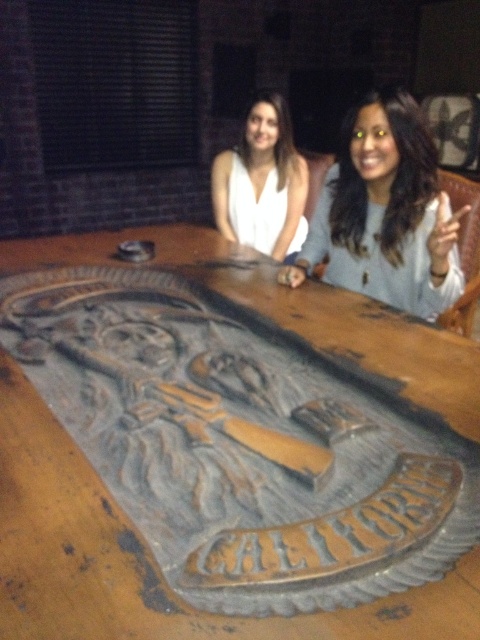
Question: Does rustic wood table at center appear on the right side of white matte shirt at center?

Choices:
 (A) yes
 (B) no

Answer: (B)

Question: Which point is closer to the camera?

Choices:
 (A) (237, 170)
 (B) (322, 237)

Answer: (B)

Question: Does matte gray sweater at center have a larger size compared to white matte shirt at center?

Choices:
 (A) no
 (B) yes

Answer: (B)

Question: Which is nearer to the matte gray sweater at center?

Choices:
 (A) rustic wood table at center
 (B) white matte shirt at center

Answer: (A)

Question: Can you confirm if matte gray sweater at center is positioned above white matte shirt at center?

Choices:
 (A) yes
 (B) no

Answer: (B)

Question: Estimate the real-world distances between objects in this image. Which object is closer to the white matte shirt at center?

Choices:
 (A) matte gray sweater at center
 (B) rustic wood table at center

Answer: (B)